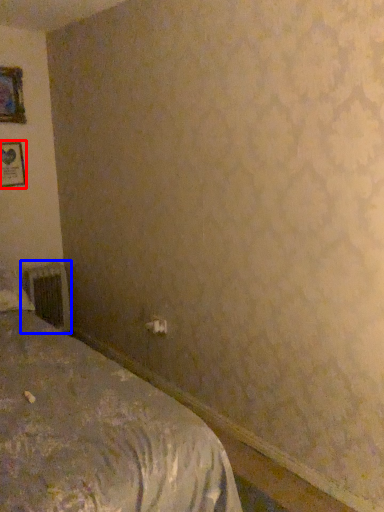
Question: Which object is closer to the camera taking this photo, picture frame (highlighted by a red box) or radiator (highlighted by a blue box)?

Choices:
 (A) picture frame
 (B) radiator

Answer: (A)